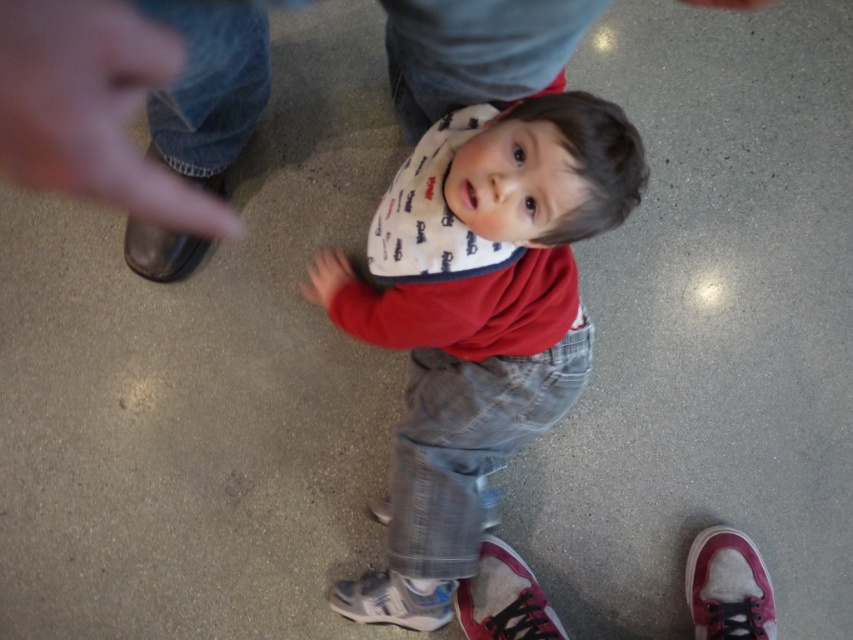
Question: Can you confirm if brown leather shoe at upper left is thinner than matte black hand at upper center?

Choices:
 (A) no
 (B) yes

Answer: (A)

Question: Does matte red shirt at center come behind brown leather hand at upper left?

Choices:
 (A) no
 (B) yes

Answer: (B)

Question: Estimate the real-world distances between objects in this image. Which object is closer to the matte black hand at upper center?

Choices:
 (A) matte red hand at center
 (B) brown leather hand at upper left

Answer: (A)

Question: Among these objects, which one is farthest from the camera?

Choices:
 (A) matte red hand at center
 (B) brown leather shoe at upper left
 (C) matte black hand at upper center

Answer: (C)

Question: Is brown leather hand at upper left wider than brown leather shoe at upper left?

Choices:
 (A) yes
 (B) no

Answer: (A)

Question: Among these objects, which one is farthest from the camera?

Choices:
 (A) white textured sneaker at lower center
 (B) matte black hand at upper center

Answer: (B)